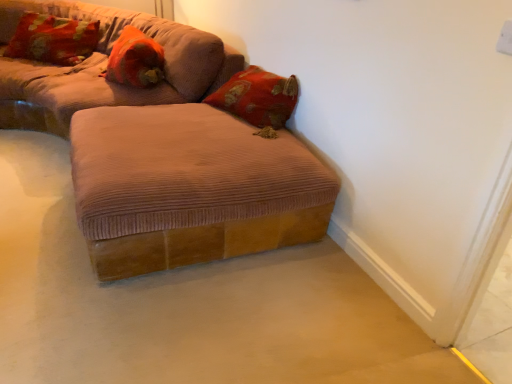
Question: Does orange corduroy pillow at upper left, marked as the 1th pillow in a right-to-left arrangement, have a smaller size compared to corduroy brown ottoman at lower center, which is the first studio couch in bottom-to-top order?

Choices:
 (A) yes
 (B) no

Answer: (A)

Question: Can you confirm if orange corduroy pillow at upper left, arranged as the second pillow when viewed from the left, is positioned to the right of corduroy brown ottoman at lower center, which is the first studio couch in bottom-to-top order?

Choices:
 (A) yes
 (B) no

Answer: (B)

Question: From the image's perspective, would you say orange corduroy pillow at upper left, arranged as the second pillow when viewed from the left, is positioned over corduroy brown ottoman at lower center, which is the first studio couch in bottom-to-top order?

Choices:
 (A) yes
 (B) no

Answer: (A)

Question: Can you confirm if orange corduroy pillow at upper left, marked as the 1th pillow in a right-to-left arrangement, is taller than corduroy brown ottoman at lower center, which is the first studio couch in bottom-to-top order?

Choices:
 (A) yes
 (B) no

Answer: (B)

Question: Is orange corduroy pillow at upper left, arranged as the second pillow when viewed from the left, beside corduroy brown ottoman at lower center, which is the first studio couch in bottom-to-top order?

Choices:
 (A) yes
 (B) no

Answer: (B)

Question: From a real-world perspective, is orange corduroy pillow at upper left, arranged as the second pillow when viewed from the left, on corduroy brown ottoman at lower center, which is the first studio couch in bottom-to-top order?

Choices:
 (A) no
 (B) yes

Answer: (B)

Question: From the image's perspective, is corduroy brown ottoman at center, which is counted as the second studio couch, starting from the bottom, on top of brown corduroy ottoman at center?

Choices:
 (A) no
 (B) yes

Answer: (B)

Question: Is corduroy brown ottoman at center, marked as the 1th studio couch in a top-to-bottom arrangement, wider than brown corduroy ottoman at center?

Choices:
 (A) no
 (B) yes

Answer: (B)

Question: Can you confirm if corduroy brown ottoman at center, which is counted as the second studio couch, starting from the bottom, is smaller than brown corduroy ottoman at center?

Choices:
 (A) yes
 (B) no

Answer: (B)

Question: Is corduroy brown ottoman at center, which is counted as the second studio couch, starting from the bottom, further to the viewer compared to brown corduroy ottoman at center?

Choices:
 (A) yes
 (B) no

Answer: (A)

Question: Is corduroy brown ottoman at center, marked as the 1th studio couch in a top-to-bottom arrangement, bigger than brown corduroy ottoman at center?

Choices:
 (A) no
 (B) yes

Answer: (B)

Question: Is corduroy brown ottoman at center, which is counted as the second studio couch, starting from the bottom, turned away from brown corduroy ottoman at center?

Choices:
 (A) yes
 (B) no

Answer: (B)

Question: Is velvet floral pillow at upper left, positioned as the 2th pillow in right-to-left order, to the left of brown corduroy ottoman at center from the viewer's perspective?

Choices:
 (A) yes
 (B) no

Answer: (A)